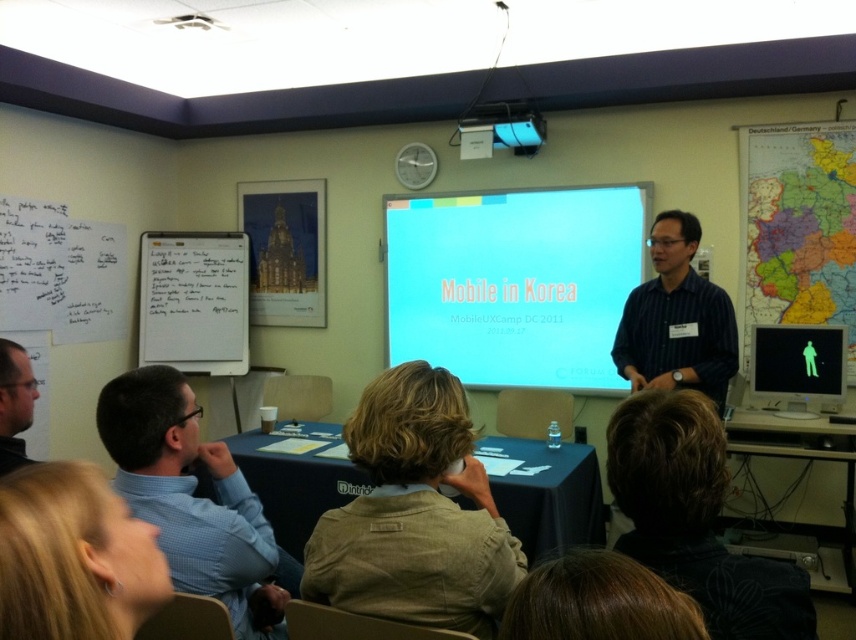
Question: Which point is farther to the camera?

Choices:
 (A) (797, 316)
 (B) (685, 272)
 (C) (415, 244)
 (D) (494, 125)

Answer: (C)

Question: Is map paper at upper right smaller than blue striped shirt at center?

Choices:
 (A) no
 (B) yes

Answer: (A)

Question: Among these objects, which one is nearest to the camera?

Choices:
 (A) matte black shirt at lower left
 (B) map paper at upper right

Answer: (A)

Question: Which point is farther to the camera?

Choices:
 (A) whiteboard at left
 (B) map paper at upper right
 (C) blue striped shirt at center

Answer: (A)

Question: In this image, where is matte black shirt at lower left located relative to blue plastic projector at upper center?

Choices:
 (A) right
 (B) left

Answer: (B)

Question: Is blue matte projector screen at center to the left of blue checkered shirt at lower left from the viewer's perspective?

Choices:
 (A) no
 (B) yes

Answer: (A)